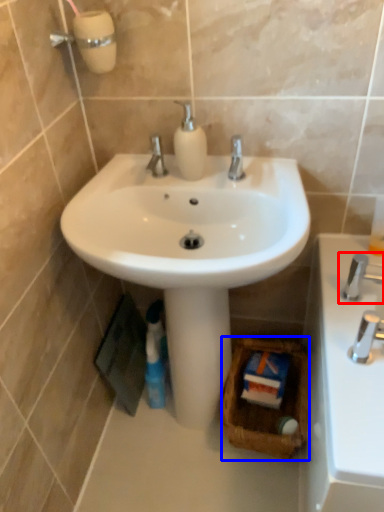
Question: Which object is further to the camera taking this photo, tap (highlighted by a red box) or basket (highlighted by a blue box)?

Choices:
 (A) tap
 (B) basket

Answer: (B)